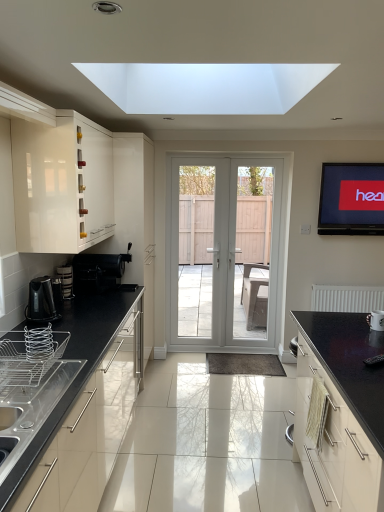
Identify the location of free spot above matte black tv at upper right (from a real-world perspective). This screenshot has height=512, width=384. (354, 158).